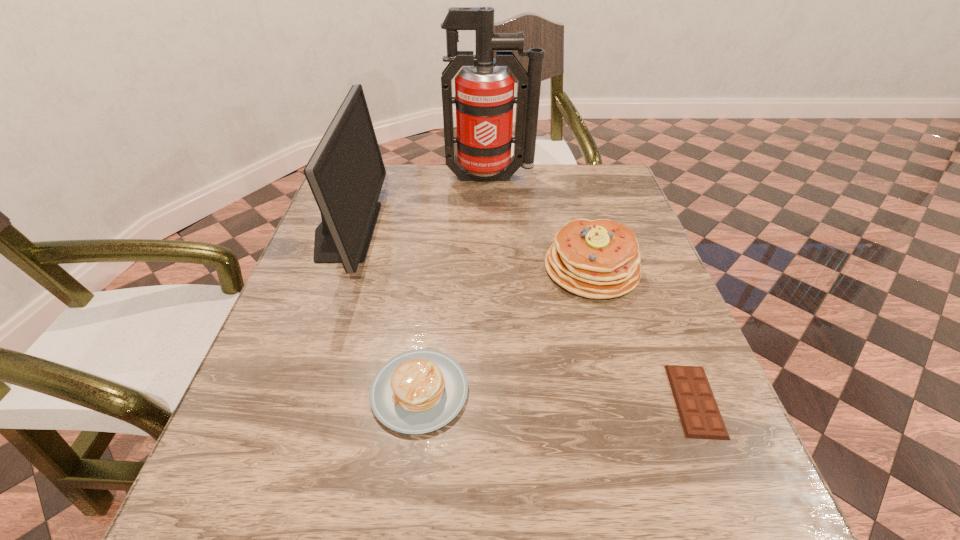
Locate an element on the screen. This screenshot has width=960, height=540. vacant area that lies between the chocolate bar and the shorter pancake is located at coordinates (558, 396).

This screenshot has width=960, height=540. I want to click on unoccupied position between the second shortest object and the tallest object, so click(455, 285).

Find the location of a particular element. empty location between the second tallest object and the farther pancake is located at coordinates (468, 250).

Where is `vacant area that lies between the shortest object and the leftmost object`? vacant area that lies between the shortest object and the leftmost object is located at coordinates (520, 315).

Locate an element on the screen. object that ranks as the third closest to the computer monitor is located at coordinates (599, 259).

The image size is (960, 540). I want to click on the second closest object relative to the farther pancake, so (419, 391).

This screenshot has height=540, width=960. In order to click on vacant area in the image that satisfies the following two spatial constraints: 1. on the screen side of the leftmost object; 2. on the right side of the taller pancake in this screenshot , I will do `click(332, 269)`.

Identify the location of vacant space that satisfies the following two spatial constraints: 1. on the screen side of the shorter pancake; 2. on the right side of the second tallest object. Image resolution: width=960 pixels, height=540 pixels. (287, 391).

Find the location of a particular element. The height and width of the screenshot is (540, 960). vacant space that satisfies the following two spatial constraints: 1. on the front side of the third shortest object; 2. on the left side of the chocolate bar is located at coordinates (628, 401).

Identify the location of free location that satisfies the following two spatial constraints: 1. on the front label side of the taller pancake; 2. on the right side of the tallest object. (493, 269).